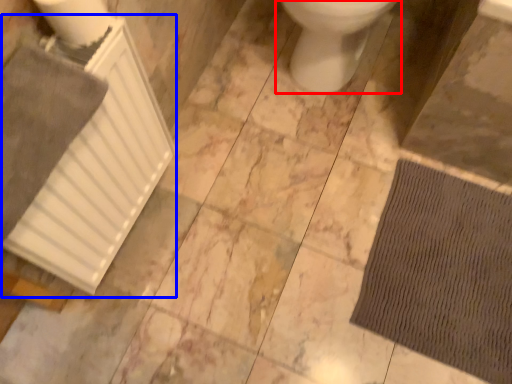
Question: Among these objects, which one is farthest to the camera, toilet (highlighted by a red box) or radiator (highlighted by a blue box)?

Choices:
 (A) toilet
 (B) radiator

Answer: (A)